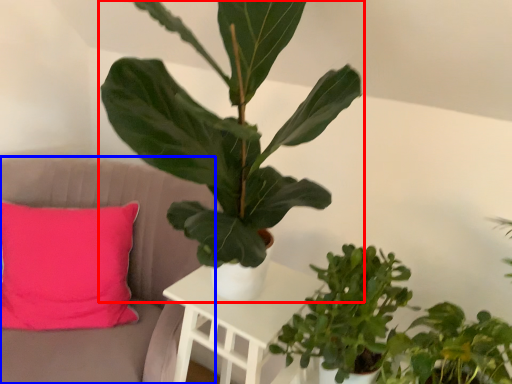
Question: Which point is further to the camera, houseplant (highlighted by a red box) or armchair (highlighted by a blue box)?

Choices:
 (A) houseplant
 (B) armchair

Answer: (B)